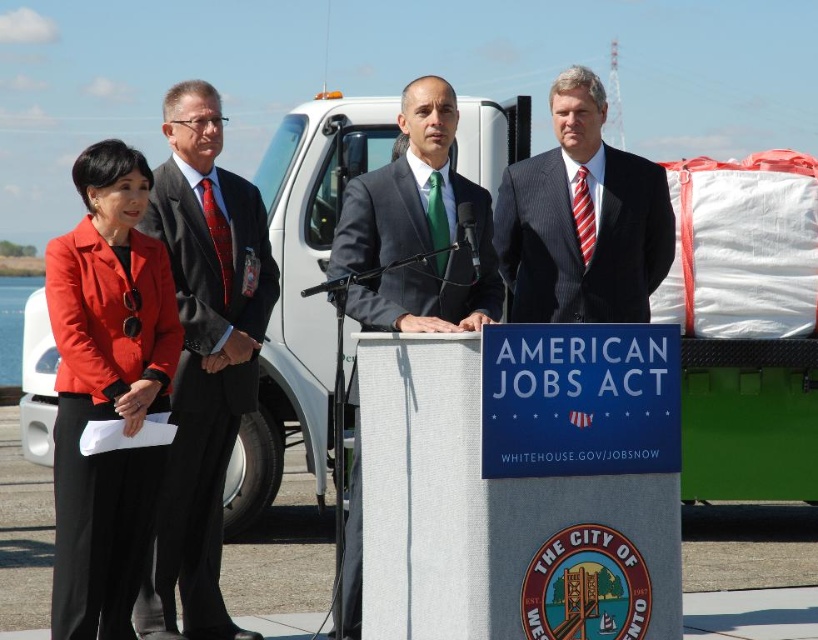
Who is taller, matte red blazer at left or matte gray suit at center?

Standing taller between the two is matte red blazer at left.

Does point (137, 326) lie in front of point (447, 118)?

Yes, it is.

Identify the location of matte red blazer at left. Image resolution: width=818 pixels, height=640 pixels. (106, 390).

Locate an element on the screen. The height and width of the screenshot is (640, 818). white matte podium at center is located at coordinates (520, 483).

Does white matte podium at center appear under matte red blazer at left?

Indeed, white matte podium at center is positioned under matte red blazer at left.

The width and height of the screenshot is (818, 640). Describe the element at coordinates (520, 483) in the screenshot. I see `white matte podium at center` at that location.

Find the location of a particular element. The width and height of the screenshot is (818, 640). white matte podium at center is located at coordinates (520, 483).

Who is lower down, matte red blazer at left or matte black suit at left?

matte red blazer at left is below.

Which is behind, point (160, 276) or point (200, 584)?

The point (200, 584) is more distant.

The height and width of the screenshot is (640, 818). I want to click on matte red blazer at left, so click(106, 390).